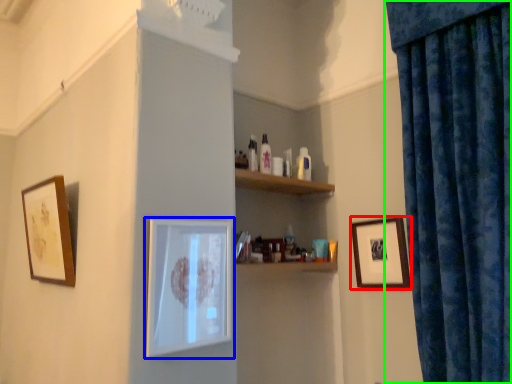
Question: Based on their relative distances, which object is farther from picture frame (highlighted by a red box)? Choose from picture frame (highlighted by a blue box) and curtain (highlighted by a green box).

Choices:
 (A) picture frame
 (B) curtain

Answer: (A)